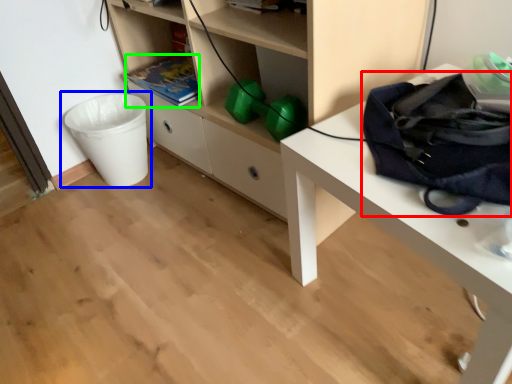
Question: Which object is positioned closest to messenger bag (highlighted by a red box)? Select from waste container (highlighted by a blue box) and book (highlighted by a green box).

Choices:
 (A) waste container
 (B) book

Answer: (B)